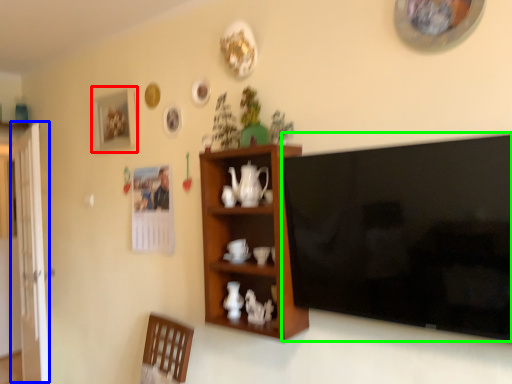
Question: Which object is positioned closest to picture frame (highlighted by a red box)? Select from glass door (highlighted by a blue box) and television (highlighted by a green box).

Choices:
 (A) glass door
 (B) television

Answer: (A)